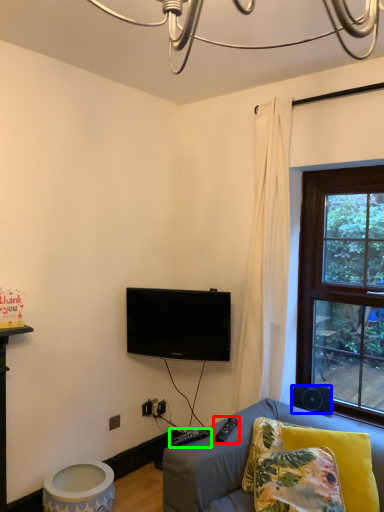
Question: Estimate the real-world distances between objects in this image. Which object is farther from remote (highlighted by a red box), loudspeaker (highlighted by a blue box) or remote (highlighted by a green box)?

Choices:
 (A) loudspeaker
 (B) remote

Answer: (A)